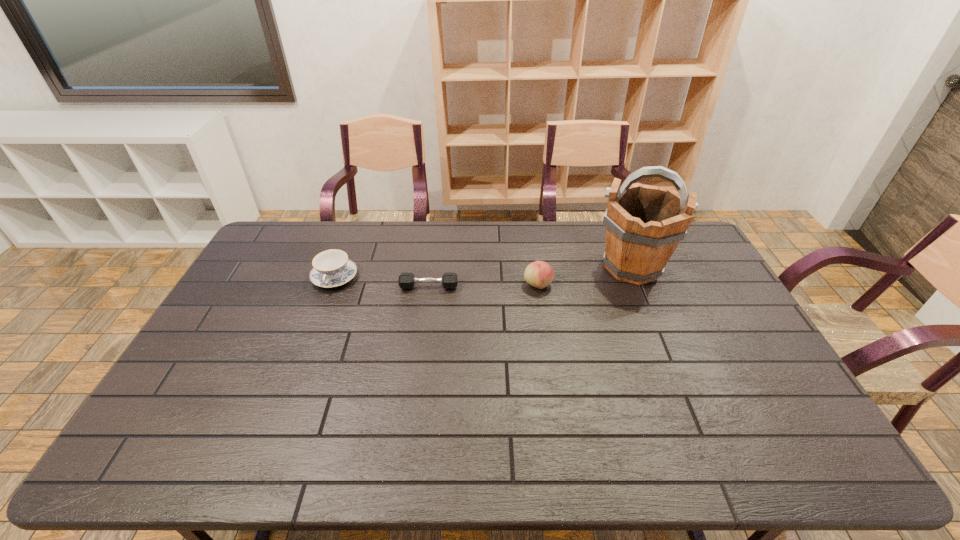
Identify the location of the rightmost object. The width and height of the screenshot is (960, 540). (644, 224).

Locate an element on the screen. The width and height of the screenshot is (960, 540). bucket is located at coordinates (644, 224).

What are the coordinates of `the second object from right to left` in the screenshot? It's located at (539, 274).

Locate an element on the screen. This screenshot has width=960, height=540. the leftmost object is located at coordinates (332, 268).

You are a GUI agent. You are given a task and a screenshot of the screen. Output one action in this format:
    pyautogui.click(x=<x>, y=<y>)
    Task: Click on the shortest object
    This screenshot has height=540, width=960.
    Given the screenshot: What is the action you would take?
    pyautogui.click(x=406, y=280)

This screenshot has height=540, width=960. Find the location of `dumbbell`. dumbbell is located at coordinates (406, 280).

You are a GUI agent. You are given a task and a screenshot of the screen. Output one action in this format:
    pyautogui.click(x=<x>, y=<y>)
    Task: Click on the free space located on the back of the bucket
    
    Given the screenshot: What is the action you would take?
    pyautogui.click(x=614, y=225)

In order to click on vacant space located 0.140m on the left of the second object from right to left in this screenshot , I will do `click(483, 285)`.

This screenshot has height=540, width=960. I want to click on blank space located 0.110m with the handle on the side of the chinaware, so click(x=320, y=318).

This screenshot has height=540, width=960. I want to click on free space located 0.200m on the front of the dumbbell, so click(422, 337).